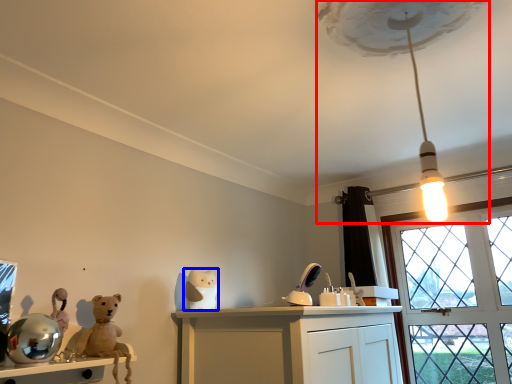
Question: Which object appears farthest to the camera in this image, lamp (highlighted by a red box) or toy (highlighted by a blue box)?

Choices:
 (A) lamp
 (B) toy

Answer: (B)